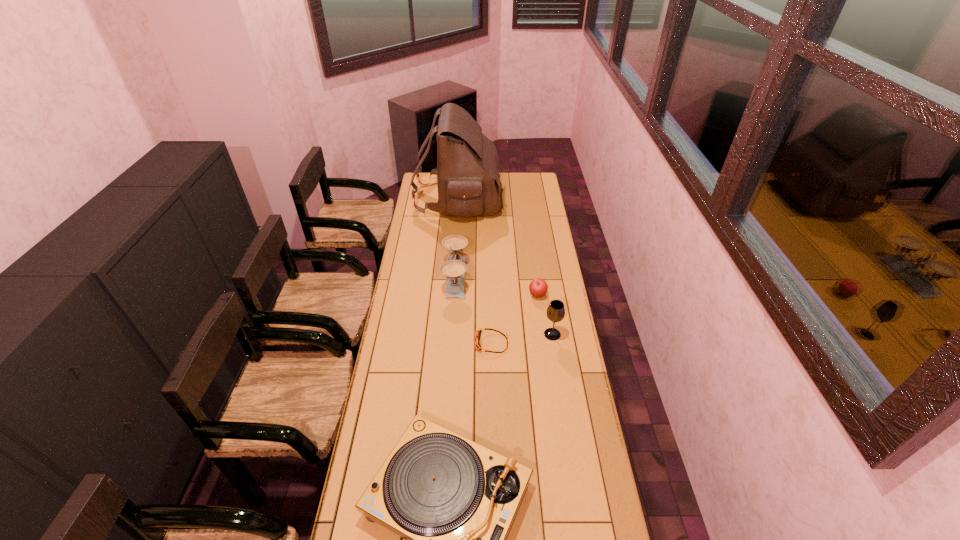
Locate an element on the screen. vacant position in the image that satisfies the following two spatial constraints: 1. on the front flap of the wineglass; 2. on the right side of the satchel is located at coordinates click(x=448, y=334).

You are a GUI agent. You are given a task and a screenshot of the screen. Output one action in this format:
    pyautogui.click(x=<x>, y=<y>)
    Task: Click on the vacant space that satisfies the following two spatial constraints: 1. on the front side of the second shortest object; 2. with the lenses facing forward on the goggles
    This screenshot has height=540, width=960.
    Given the screenshot: What is the action you would take?
    (544, 343)

Locate an element on the screen. The height and width of the screenshot is (540, 960). vacant space that satisfies the following two spatial constraints: 1. on the front-facing side of the wineglass; 2. on the right side of the scale is located at coordinates (452, 334).